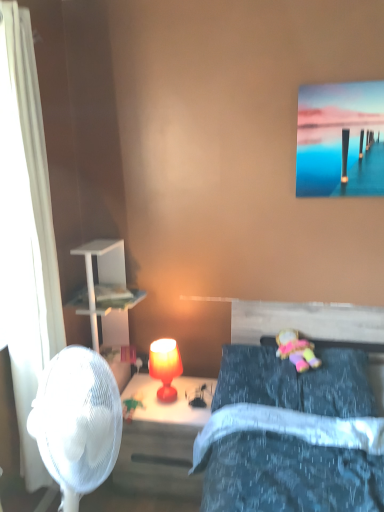
Where is `free space in front of matte orange lamp at center`? free space in front of matte orange lamp at center is located at coordinates (167, 418).